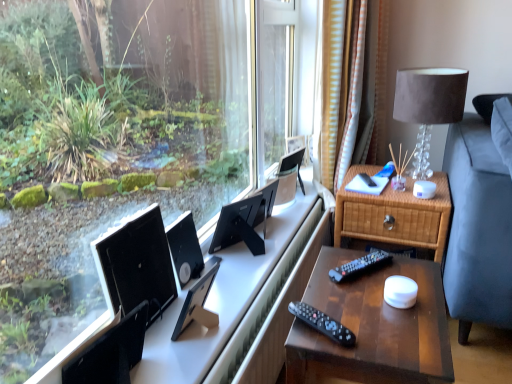
The image size is (512, 384). Identify the location of free space between matte black monitor at center, which appears as the second computer monitor when viewed from the front, and black matte computer monitor at center, arranged as the 1th computer monitor when viewed from the back. (226, 284).